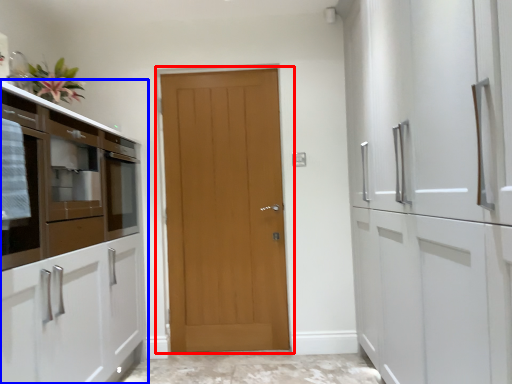
Question: Among these objects, which one is farthest to the camera, door (highlighted by a red box) or cabinetry (highlighted by a blue box)?

Choices:
 (A) door
 (B) cabinetry

Answer: (A)